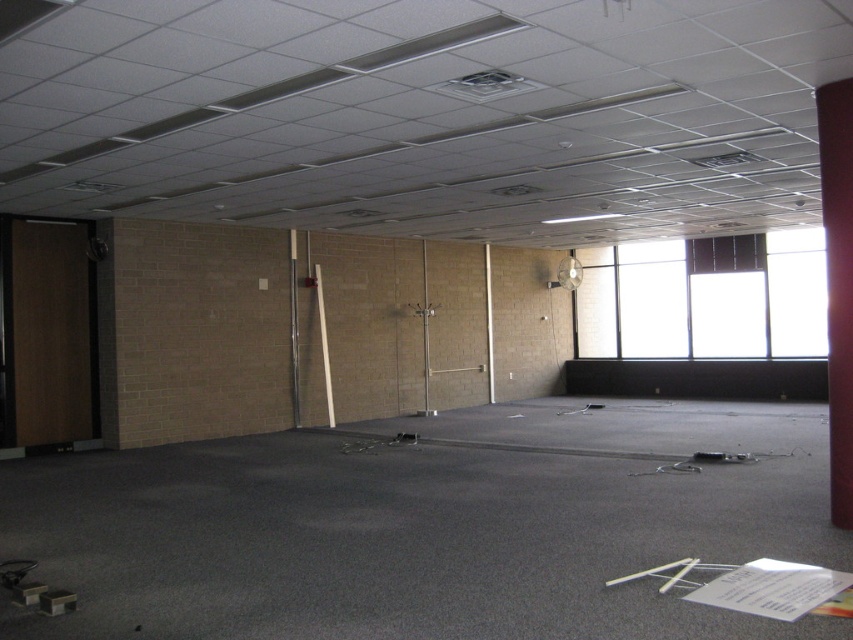
Question: Can you confirm if transparent glass window at upper right is positioned above red matte pillar at right?

Choices:
 (A) yes
 (B) no

Answer: (A)

Question: Is transparent glass window at upper right to the right of red matte pillar at right from the viewer's perspective?

Choices:
 (A) no
 (B) yes

Answer: (B)

Question: Which object appears farthest from the camera in this image?

Choices:
 (A) red matte pillar at right
 (B) transparent glass window at upper right

Answer: (B)

Question: Is transparent glass window at upper right further to camera compared to red matte pillar at right?

Choices:
 (A) yes
 (B) no

Answer: (A)